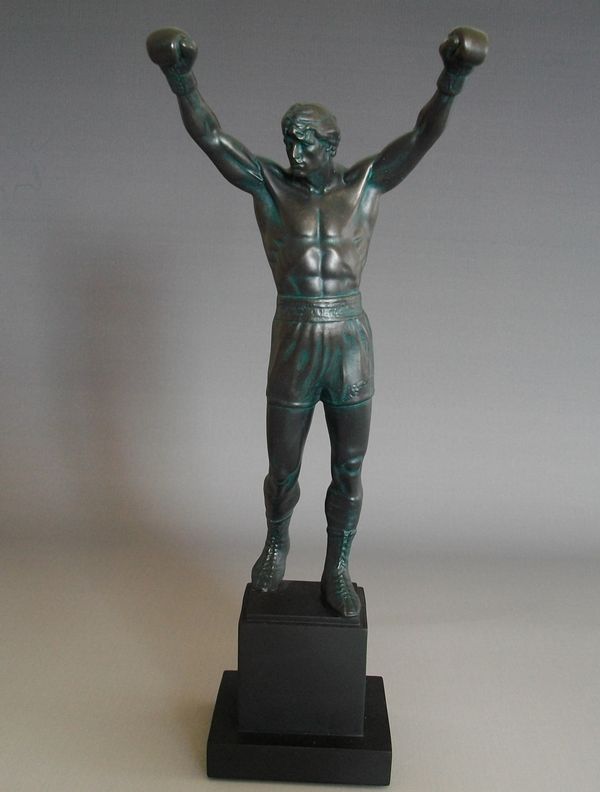
Image resolution: width=600 pixels, height=792 pixels. Identify the location of box shaped platform. (297, 702).